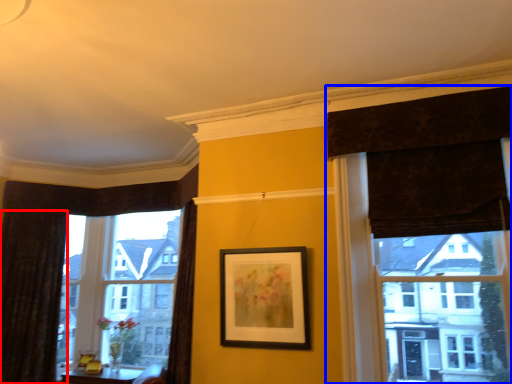
Question: Which object appears farthest to the camera in this image, curtain (highlighted by a red box) or curtain (highlighted by a blue box)?

Choices:
 (A) curtain
 (B) curtain

Answer: (A)